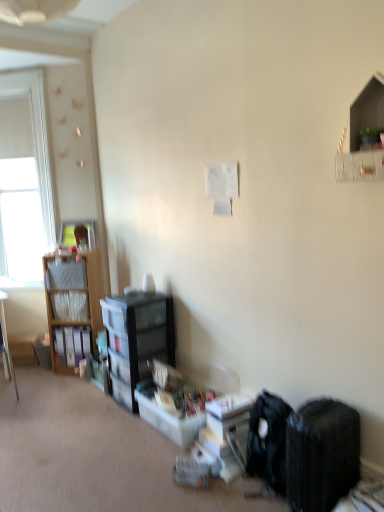
You are a GUI agent. You are given a task and a screenshot of the screen. Output one action in this format:
    pyautogui.click(x=<x>, y=<y>)
    Task: Click on the black fabric backpack at lower right
    The image size is (384, 512).
    Given the screenshot: What is the action you would take?
    pyautogui.click(x=321, y=454)

Describe the element at coordinates (24, 177) in the screenshot. I see `white matte window screen at left` at that location.

Where is `matte wooden picture frame at upper left`? matte wooden picture frame at upper left is located at coordinates (74, 233).

Which of these two, white glossy shelf at upper right, the 1th shelf when ordered from right to left, or matte plastic shelf at left, marked as the 2th shelf in a back-to-front arrangement, is wider?

Wider between the two is matte plastic shelf at left, marked as the 2th shelf in a back-to-front arrangement.

Does white glossy shelf at upper right, placed as the first shelf when sorted from top to bottom, have a greater height compared to matte plastic shelf at left, which is counted as the first shelf, starting from the left?

Correct, white glossy shelf at upper right, placed as the first shelf when sorted from top to bottom, is much taller as matte plastic shelf at left, which is counted as the first shelf, starting from the left.

From the image's perspective, is white glossy shelf at upper right, acting as the 3th shelf starting from the bottom, over matte plastic shelf at left, marked as the 3th shelf in a right-to-left arrangement?

Yes, from the image's perspective, white glossy shelf at upper right, acting as the 3th shelf starting from the bottom, is above matte plastic shelf at left, marked as the 3th shelf in a right-to-left arrangement.

Which is in front, black fabric backpack at lower right or matte plastic shelf at left, the second shelf viewed from the front?

black fabric backpack at lower right is in front.

Considering the positions of points (309, 434) and (62, 270), is point (309, 434) closer to camera compared to point (62, 270)?

That is True.

Is black fabric backpack at lower right at the left side of matte plastic shelf at left, which is counted as the first shelf, starting from the left?

No, black fabric backpack at lower right is not to the left of matte plastic shelf at left, which is counted as the first shelf, starting from the left.

Is black fabric backpack at lower right not within matte plastic shelf at left, which appears as the second shelf when ordered from the bottom?

Absolutely, black fabric backpack at lower right is external to matte plastic shelf at left, which appears as the second shelf when ordered from the bottom.

Considering the points (71, 265) and (3, 339), which point is in front, point (71, 265) or point (3, 339)?

Point (71, 265)

From a real-world perspective, is matte plastic shelf at left, the second shelf positioned from the top, physically above matte wood desk at left?

Yes, from a real-world perspective, matte plastic shelf at left, the second shelf positioned from the top, is over matte wood desk at left

The image size is (384, 512). I want to click on shelf that is the 1st one when counting backward from the matte wood desk at left, so click(x=66, y=273).

Who is taller, wooden shelf at left, which appears as the second shelf when viewed from the left, or matte wooden picture frame at upper left?

matte wooden picture frame at upper left.

From a real-world perspective, is wooden shelf at left, the first shelf when ordered from bottom to top, located beneath matte wooden picture frame at upper left?

Indeed, from a real-world perspective, wooden shelf at left, the first shelf when ordered from bottom to top, is positioned beneath matte wooden picture frame at upper left.

Between wooden shelf at left, placed as the 1th shelf when sorted from back to front, and matte wooden picture frame at upper left, which one has larger width?

wooden shelf at left, placed as the 1th shelf when sorted from back to front.

From the image's perspective, between wooden shelf at left, the 3th shelf from the front, and matte wooden picture frame at upper left, which one is located above?

From the image's view, matte wooden picture frame at upper left is above.

Is black fabric backpack at lower right shorter than white glossy shelf at upper right, which appears as the third shelf when viewed from the back?

No.

Is the surface of black fabric backpack at lower right in direct contact with white glossy shelf at upper right, placed as the first shelf when sorted from top to bottom?

black fabric backpack at lower right is not next to white glossy shelf at upper right, placed as the first shelf when sorted from top to bottom, and they're not touching.

Could you tell me if black fabric backpack at lower right is facing white glossy shelf at upper right, placed as the first shelf when sorted from top to bottom?

No, black fabric backpack at lower right does not turn towards white glossy shelf at upper right, placed as the first shelf when sorted from top to bottom.

Considering the points (331, 446) and (366, 132), which point is in front, point (331, 446) or point (366, 132)?

Point (366, 132)

From a real-world perspective, which object rests below the other?

In real-world perspective, translucent plastic storage box at lower center is lower.

Can we say matte wooden picture frame at upper left lies outside translucent plastic storage box at lower center?

Absolutely, matte wooden picture frame at upper left is external to translucent plastic storage box at lower center.

Considering the positions of objects matte wooden picture frame at upper left and translucent plastic storage box at lower center in the image provided, who is more to the right, matte wooden picture frame at upper left or translucent plastic storage box at lower center?

From the viewer's perspective, translucent plastic storage box at lower center appears more on the right side.

Between matte wooden picture frame at upper left and translucent plastic storage box at lower center, which one has larger width?

translucent plastic storage box at lower center is wider.

In terms of height, does black plastic bookcase at center-left look taller or shorter compared to wooden shelf at left, which ranks as the second shelf in right-to-left order?

Considering their sizes, black plastic bookcase at center-left has more height than wooden shelf at left, which ranks as the second shelf in right-to-left order.

Are black plastic bookcase at center-left and wooden shelf at left, which appears as the second shelf when viewed from the left, far apart?

No, black plastic bookcase at center-left is in close proximity to wooden shelf at left, which appears as the second shelf when viewed from the left.

You are a GUI agent. You are given a task and a screenshot of the screen. Output one action in this format:
    pyautogui.click(x=<x>, y=<y>)
    Task: Click on the 1st shelf behind when counting from the white glossy shelf at upper right, which ranks as the first shelf in front-to-back order
    The width and height of the screenshot is (384, 512).
    Given the screenshot: What is the action you would take?
    pyautogui.click(x=66, y=273)

The height and width of the screenshot is (512, 384). In order to click on the 2nd shelf counting from the left side of the black fabric backpack at lower right in this screenshot , I will do `click(66, 273)`.

From the image, which object appears to be farther from matte wooden picture frame at upper left, matte wood desk at left or white glossy shelf at upper right, placed as the 3th shelf when sorted from left to right?

white glossy shelf at upper right, placed as the 3th shelf when sorted from left to right.

Considering their positions, is wooden cabinet at left positioned further to black fabric backpack at lower right than matte wooden picture frame at upper left?

Based on the image, matte wooden picture frame at upper left appears to be further to black fabric backpack at lower right.

From the image, which object appears to be nearer to matte plastic shelf at left, the second shelf viewed from the front, white matte window screen at left or matte wood desk at left?

Based on the image, matte wood desk at left appears to be nearer to matte plastic shelf at left, the second shelf viewed from the front.

From the image, which object appears to be nearer to white matte window screen at left, wooden shelf at left, the third shelf viewed from the top, or wooden cabinet at left?

wooden cabinet at left is positioned closer to the anchor white matte window screen at left.

Which object lies further to the anchor point matte wood desk at left, black fabric backpack at lower right or black plastic bookcase at center-left?

black fabric backpack at lower right lies further to matte wood desk at left than the other object.

From the image, which object appears to be farther from matte plastic shelf at left, the second shelf positioned from the top, black plastic bookcase at center-left or black fabric backpack at lower right?

The object further to matte plastic shelf at left, the second shelf positioned from the top, is black fabric backpack at lower right.

From the image, which object appears to be nearer to white matte window screen at left, matte plastic shelf at left, the second shelf positioned from the top, or black plastic bookcase at center-left?

matte plastic shelf at left, the second shelf positioned from the top.

When comparing their distances from black fabric backpack at lower right, does black plastic bookcase at center-left or white matte window screen at left seem further?

Based on the image, white matte window screen at left appears to be further to black fabric backpack at lower right.

Locate an element on the screen. This screenshot has height=512, width=384. picture frame between white matte window screen at left and black plastic bookcase at center-left from top to bottom is located at coordinates pos(74,233).

Locate an element on the screen. The width and height of the screenshot is (384, 512). cabinetry positioned between white glossy shelf at upper right, which appears as the third shelf when viewed from the back, and matte wooden picture frame at upper left from near to far is located at coordinates (74, 297).

Locate an element on the screen. Image resolution: width=384 pixels, height=512 pixels. cabinetry positioned between translucent plastic storage box at lower center and matte wooden picture frame at upper left from near to far is located at coordinates (74, 297).

Locate an element on the screen. This screenshot has width=384, height=512. storage box between black fabric backpack at lower right and matte wooden picture frame at upper left along the z-axis is located at coordinates (170, 421).